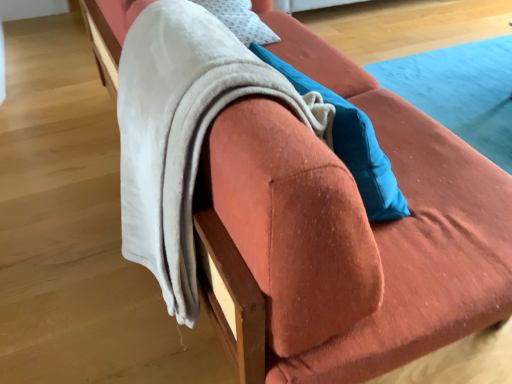
Question: From the image's perspective, is soft white fleece blanket at upper left located above white soft pillow at upper center?

Choices:
 (A) yes
 (B) no

Answer: (B)

Question: Is soft white fleece blanket at upper left outside white soft pillow at upper center?

Choices:
 (A) yes
 (B) no

Answer: (A)

Question: Considering the relative sizes of soft white fleece blanket at upper left and white soft pillow at upper center in the image provided, is soft white fleece blanket at upper left taller than white soft pillow at upper center?

Choices:
 (A) no
 (B) yes

Answer: (B)

Question: From the image's perspective, is soft white fleece blanket at upper left located beneath white soft pillow at upper center?

Choices:
 (A) no
 (B) yes

Answer: (B)

Question: From a real-world perspective, is soft white fleece blanket at upper left located beneath white soft pillow at upper center?

Choices:
 (A) no
 (B) yes

Answer: (A)

Question: Is soft white fleece blanket at upper left positioned far away from white soft pillow at upper center?

Choices:
 (A) no
 (B) yes

Answer: (A)

Question: Could you tell me if white soft pillow at upper center is turned towards soft white fleece blanket at upper left?

Choices:
 (A) yes
 (B) no

Answer: (A)

Question: From a real-world perspective, is white soft pillow at upper center over soft white fleece blanket at upper left?

Choices:
 (A) yes
 (B) no

Answer: (B)

Question: Is white soft pillow at upper center turned away from soft white fleece blanket at upper left?

Choices:
 (A) no
 (B) yes

Answer: (A)

Question: Is white soft pillow at upper center wider than soft white fleece blanket at upper left?

Choices:
 (A) no
 (B) yes

Answer: (A)

Question: Is white soft pillow at upper center thinner than soft white fleece blanket at upper left?

Choices:
 (A) yes
 (B) no

Answer: (A)

Question: Can you confirm if white soft pillow at upper center is taller than soft white fleece blanket at upper left?

Choices:
 (A) yes
 (B) no

Answer: (B)

Question: Based on their positions, is soft white fleece blanket at upper left located to the left or right of white soft pillow at upper center?

Choices:
 (A) left
 (B) right

Answer: (A)